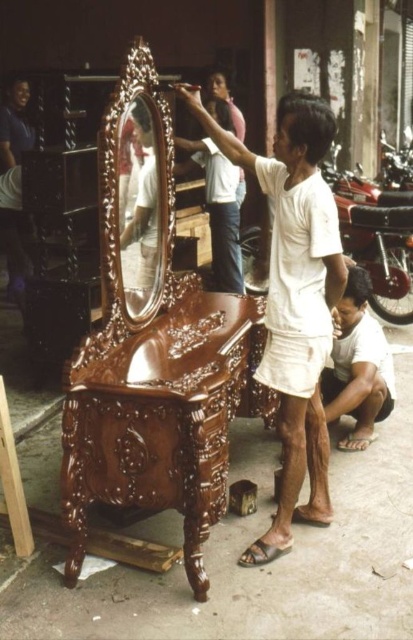
There is a person wearing a white cotton shirt at center and another person in a pink top and jeans. How far apart are these two people?

The two people are 9.48 feet apart.

You are standing at the origin point in the image. Which direction should you move to reach the shiny brown wood vanity at center?

The shiny brown wood vanity at center is located at point 0.648 on the x axis and 0.390 on the y axis. Since you are at the origin, you should move right along the x axis and up along the y axis to reach it.

You are a photographer setting up for a shoot at this outdoor market scene. You notice the white cotton shirt at center and the polished wood mirror at center. Which object should you focus on first to ensure it is in sharp focus if you want both to be clear in the photo?

You should focus on the white cotton shirt at center first because it is closer to the viewer than the polished wood mirror at center, so adjusting focus from near to far will help both be in sharp focus.